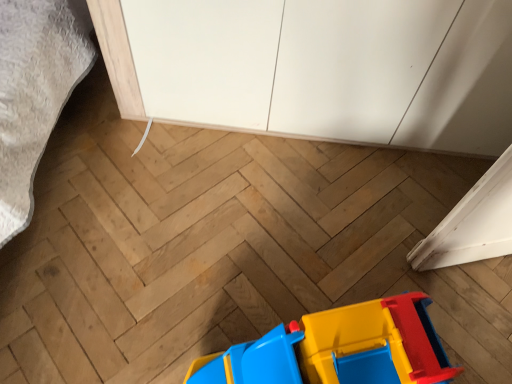
At what (x,y) coordinates should I click in order to perform the action: click on white matte cabinet at upper center. Please return your answer as a coordinate pair (x, y). Looking at the image, I should click on (318, 68).

Describe the element at coordinates (318, 68) in the screenshot. I see `white matte cabinet at upper center` at that location.

Measure the distance between point (369, 18) and camera.

The depth of point (369, 18) is 3.33 feet.

I want to click on matte plastic toy at lower center, so click(339, 349).

Measure the distance between matte plastic toy at lower center and camera.

The depth of matte plastic toy at lower center is 77.35 centimeters.

Describe the element at coordinates (339, 349) in the screenshot. This screenshot has height=384, width=512. I see `matte plastic toy at lower center` at that location.

The height and width of the screenshot is (384, 512). Find the location of `white matte cabinet at upper center`. white matte cabinet at upper center is located at coordinates (318, 68).

Does matte plastic toy at lower center appear on the left side of white matte cabinet at upper center?

Correct, you'll find matte plastic toy at lower center to the left of white matte cabinet at upper center.

In the image, is matte plastic toy at lower center positioned in front of or behind white matte cabinet at upper center?

Visually, matte plastic toy at lower center is located in front of white matte cabinet at upper center.

Which point is more forward, (360,350) or (293,119)?

The point (360,350) is in front.

From the image's perspective, who appears lower, matte plastic toy at lower center or white matte cabinet at upper center?

From the image's view, matte plastic toy at lower center is below.

From a real-world perspective, is matte plastic toy at lower center physically below white matte cabinet at upper center?

Yes.

Is matte plastic toy at lower center wider than white matte cabinet at upper center?

Incorrect, the width of matte plastic toy at lower center does not surpass that of white matte cabinet at upper center.

Considering the relative sizes of matte plastic toy at lower center and white matte cabinet at upper center in the image provided, is matte plastic toy at lower center shorter than white matte cabinet at upper center?

Yes.

Considering the sizes of objects matte plastic toy at lower center and white matte cabinet at upper center in the image provided, who is smaller, matte plastic toy at lower center or white matte cabinet at upper center?

matte plastic toy at lower center is smaller.

Is matte plastic toy at lower center situated inside white matte cabinet at upper center or outside?

matte plastic toy at lower center exists outside the volume of white matte cabinet at upper center.

Are matte plastic toy at lower center and white matte cabinet at upper center beside each other?

No, matte plastic toy at lower center is not beside white matte cabinet at upper center.

Is matte plastic toy at lower center positioned with its back to white matte cabinet at upper center?

Absolutely, matte plastic toy at lower center is directed away from white matte cabinet at upper center.

How many degrees apart are the facing directions of matte plastic toy at lower center and white matte cabinet at upper center?

matte plastic toy at lower center and white matte cabinet at upper center are facing 17.2 degrees away from each other.

Find the location of a particular element. The height and width of the screenshot is (384, 512). cabinetry that appears behind the matte plastic toy at lower center is located at coordinates (318, 68).

Considering the relative positions of white matte cabinet at upper center and matte plastic toy at lower center in the image provided, is white matte cabinet at upper center to the right of matte plastic toy at lower center from the viewer's perspective?

Yes, white matte cabinet at upper center is to the right of matte plastic toy at lower center.

Does white matte cabinet at upper center lie behind matte plastic toy at lower center?

Yes, the depth of white matte cabinet at upper center is greater than that of matte plastic toy at lower center.

Which is farther, (294, 41) or (373, 319)?

Point (294, 41)

From the image's perspective, is white matte cabinet at upper center above or below matte plastic toy at lower center?

white matte cabinet at upper center is above matte plastic toy at lower center.

From a real-world perspective, is white matte cabinet at upper center located beneath matte plastic toy at lower center?

No, from a real-world perspective, white matte cabinet at upper center is not below matte plastic toy at lower center.

In terms of width, does white matte cabinet at upper center look wider or thinner when compared to matte plastic toy at lower center?

Clearly, white matte cabinet at upper center has more width compared to matte plastic toy at lower center.

Considering the sizes of objects white matte cabinet at upper center and matte plastic toy at lower center in the image provided, who is taller, white matte cabinet at upper center or matte plastic toy at lower center?

With more height is white matte cabinet at upper center.

Looking at the image, does white matte cabinet at upper center seem bigger or smaller compared to matte plastic toy at lower center?

Clearly, white matte cabinet at upper center is larger in size than matte plastic toy at lower center.

Would you say white matte cabinet at upper center is outside matte plastic toy at lower center?

That's correct, white matte cabinet at upper center is outside of matte plastic toy at lower center.

Is white matte cabinet at upper center not near matte plastic toy at lower center?

No, there isn't a large distance between white matte cabinet at upper center and matte plastic toy at lower center.

Looking at this image, is white matte cabinet at upper center aimed at matte plastic toy at lower center?

Yes.

Locate an element on the screen. toy located below the white matte cabinet at upper center (from the image's perspective) is located at coordinates (339, 349).

The image size is (512, 384). Identify the location of toy that appears below the white matte cabinet at upper center (from the image's perspective). (339, 349).

What are the coordinates of `toy that is on the left side of white matte cabinet at upper center` in the screenshot? It's located at [x=339, y=349].